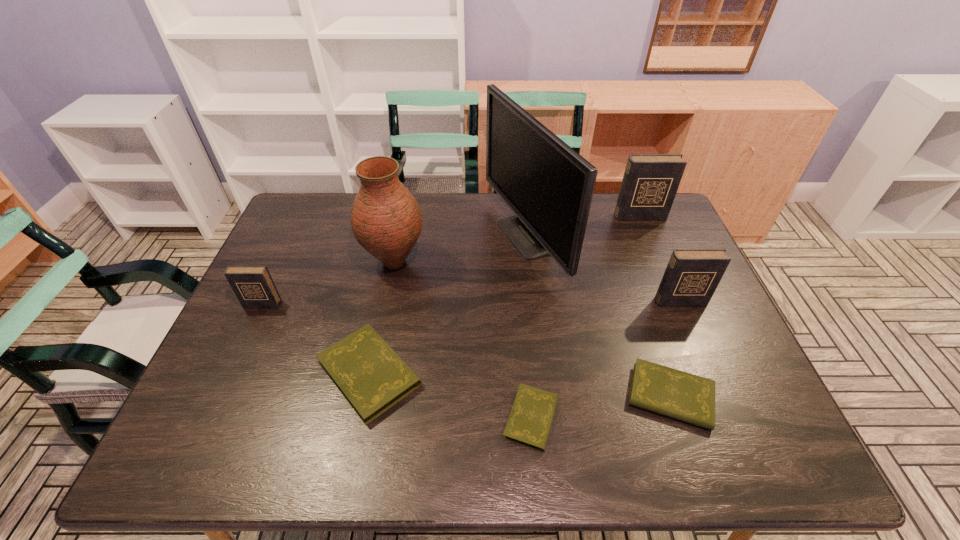
Identify the location of the seventh tallest object. (690, 398).

The image size is (960, 540). What are the coordinates of `the rightmost green diary` in the screenshot? It's located at (690, 398).

Find the location of a particular element. This screenshot has width=960, height=540. the shortest object is located at coordinates (530, 420).

In order to click on the shortest diary in this screenshot , I will do `click(530, 420)`.

Where is `vacant area situated on the front-facing side of the computer monitor`? Image resolution: width=960 pixels, height=540 pixels. vacant area situated on the front-facing side of the computer monitor is located at coordinates (465, 238).

At what (x,y) coordinates should I click in order to perform the action: click on vacant region located 0.380m on the front-facing side of the computer monitor. Please return your answer as a coordinate pair (x, y). The height and width of the screenshot is (540, 960). Looking at the image, I should click on (370, 238).

The height and width of the screenshot is (540, 960). Find the location of `free space located 0.100m on the front-facing side of the computer monitor`. free space located 0.100m on the front-facing side of the computer monitor is located at coordinates (456, 238).

This screenshot has width=960, height=540. In order to click on vacant space located on the back of the second tallest object in this screenshot , I will do `click(401, 228)`.

You are a GUI agent. You are given a task and a screenshot of the screen. Output one action in this format:
    pyautogui.click(x=<x>, y=<y>)
    Task: Click on the vacant space located on the front cover of the sixth shortest object
    
    Given the screenshot: What is the action you would take?
    pyautogui.click(x=679, y=310)

At what (x,y) coordinates should I click in order to perform the action: click on vacant region located 0.130m on the front cover of the fifth shortest object. Please return your answer as a coordinate pair (x, y). Image resolution: width=960 pixels, height=540 pixels. Looking at the image, I should click on (698, 345).